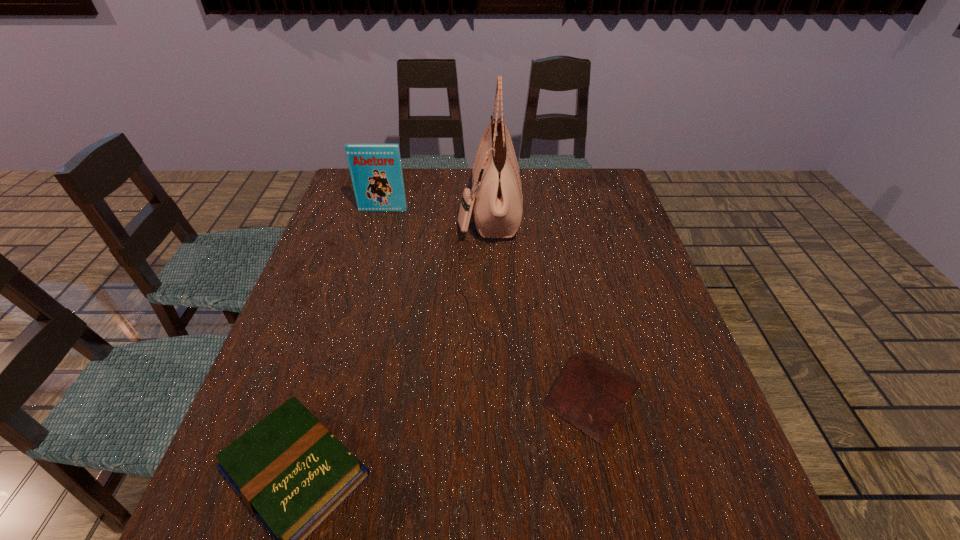
Where is `object present at the left edge`? The height and width of the screenshot is (540, 960). object present at the left edge is located at coordinates (376, 171).

I want to click on object situated at the right edge, so click(588, 393).

Find the location of a particular element. This screenshot has width=960, height=540. vacant area at the far edge is located at coordinates (569, 200).

Find the location of a particular element. Image resolution: width=960 pixels, height=540 pixels. vacant space at the near edge of the desktop is located at coordinates pos(501,521).

In order to click on blank area at the left edge in this screenshot , I will do `click(353, 225)`.

Where is `free space at the right edge of the desktop`? Image resolution: width=960 pixels, height=540 pixels. free space at the right edge of the desktop is located at coordinates (622, 214).

The width and height of the screenshot is (960, 540). In the image, there is a desktop. Identify the location of vacant space at the far right corner. (591, 200).

Locate an element on the screen. This screenshot has width=960, height=540. empty space that is in between the rightmost book and the farthest book is located at coordinates (488, 302).

At what (x,y) coordinates should I click in order to perform the action: click on vacant area that lies between the rightmost book and the second tallest object. Please return your answer as a coordinate pair (x, y). Image resolution: width=960 pixels, height=540 pixels. Looking at the image, I should click on (488, 302).

Identify the location of unoccupied area between the tallest object and the rightmost book. (540, 303).